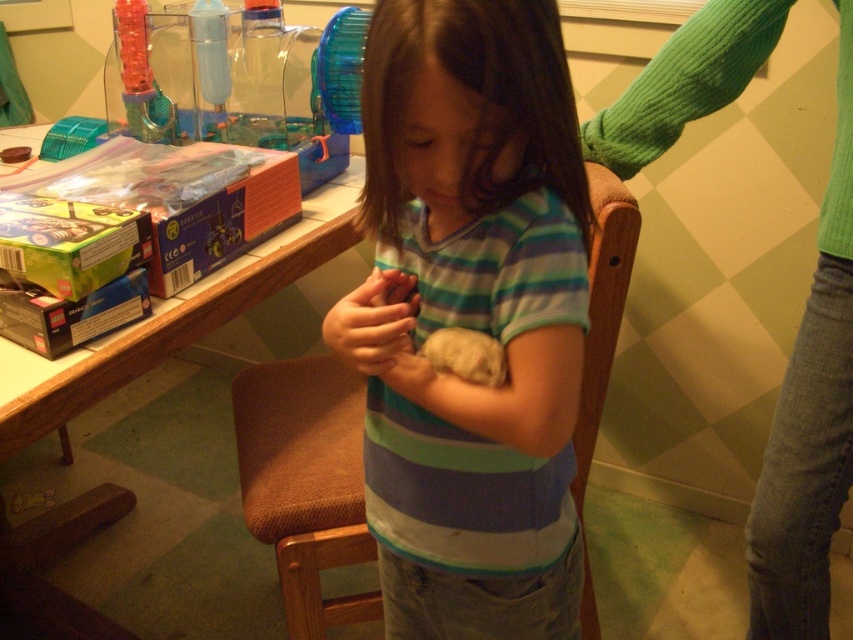
You are a photographer standing at the camera position. You want to place a 20 inch wide decorative plate on the wooden table at upper left. Will it fit on the table?

The wooden table at upper left is 35.70 inches from the camera, but the distance does not indicate the table size. The question cannot be answered with the given information.

You are a tailor standing 24 inches away from a striped cotton shirt at center that needs alterations. Can you reach it without moving closer?

The striped cotton shirt at center and viewer are 23.41 inches apart, so yes, the tailor can reach it without moving closer since the distance is less than 24 inches.

What are the coordinates of the striped cotton shirt at center?

The coordinates of the striped cotton shirt at center are at point (469, 317).